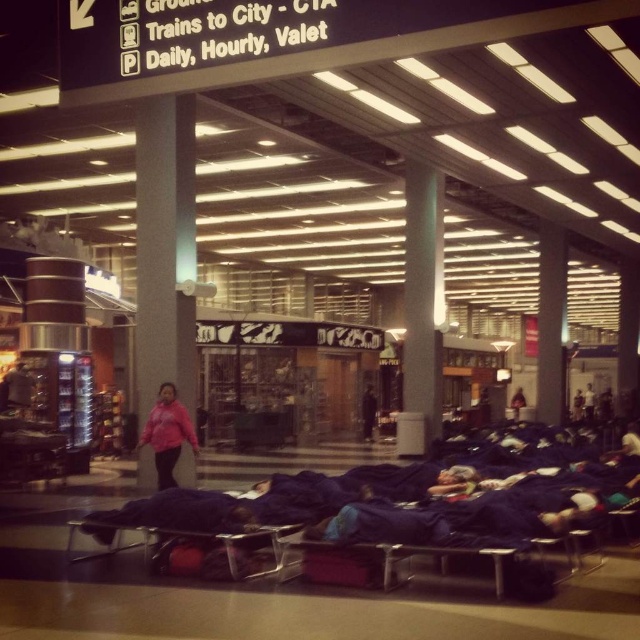
Based on the photo, you are a traveler who just arrived at the airport terminal and need to locate your pink fleece jacket at center. According to the coordinates given, where should you look for it?

The pink fleece jacket at center is located at point (168, 433), so you should look there.

You are a traveler who wants to store your backpack. You see the dark blue fabric at center and the dark blue fabric sleeping bag at center. Where can you place your backpack without covering the sleeping bag?

You can place your backpack on the dark blue fabric at center since it is above the dark blue fabric sleeping bag at center, so placing it there won